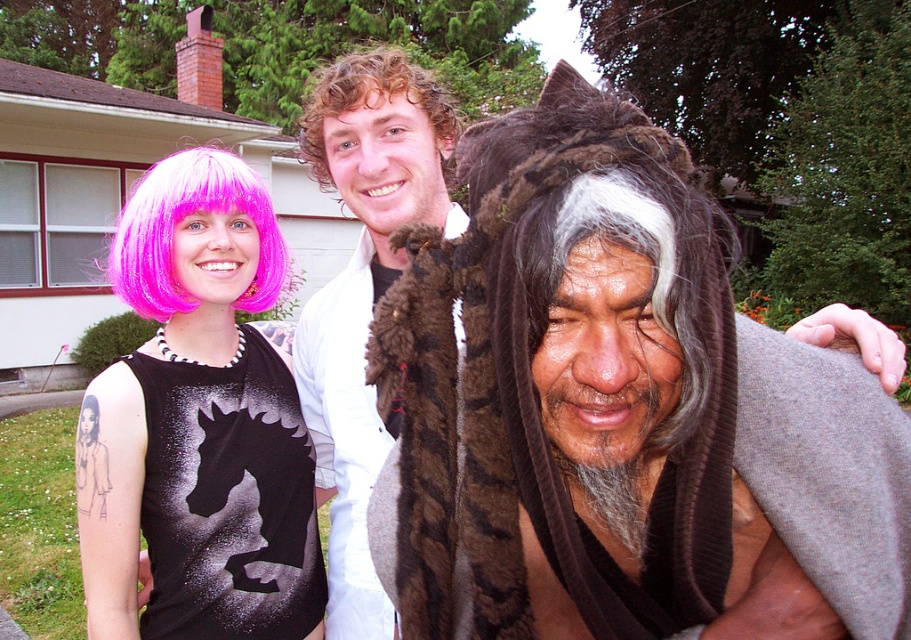
From the picture: You are a photographer setting up a camera at position point 0.000, 0.000. You want to capture a photo of the pink synthetic wig at left. What direction should you move the camera to align it with the wig?

The pink synthetic wig at left is located at point (181,220). Since the camera is at (0,0), you should move it towards the right and upward to align with the wig.

You are a photographer trying to capture a group photo of the three people in the scene. You need to ensure that the fuzzy brown fur hat at center and the pink synthetic wig at left are both in focus. Given that your camera has a depth of field that can cover 3 feet, will you be able to keep both objects in focus?

The distance between the fuzzy brown fur hat at center and the pink synthetic wig at left is 3.56 feet. Since the camera can only cover 3 feet in depth of field, the two objects will not both be in focus simultaneously.

You are a photographer setting up for a group photo. You need to ensure that all hair accessories are visible in the frame. Given that the pink synthetic wig at left is smaller than curly blonde hair at center, which person should you position closer to the camera to make their hair appear larger in the photo?

To make the pink synthetic wig at left appear larger in the photo, position the person with the pink synthetic wig at left closer to the camera since it is smaller than the curly blonde hair at center. This adjustment will help balance their sizes in the frame.